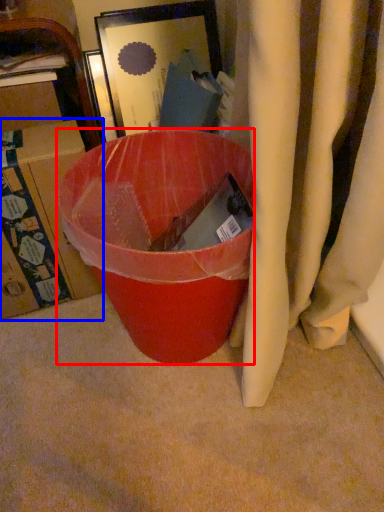
Question: Which point is further to the camera, trash bin/can (highlighted by a red box) or box (highlighted by a blue box)?

Choices:
 (A) trash bin/can
 (B) box

Answer: (B)